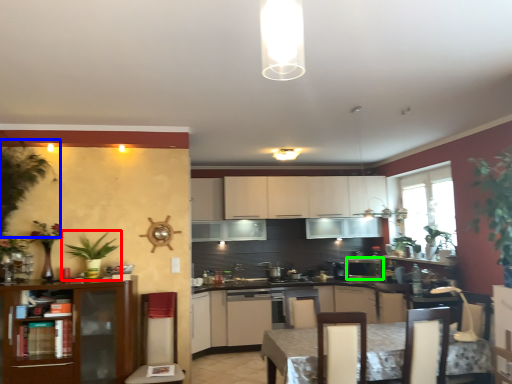
Question: Based on their relative distances, which object is farther from houseplant (highlighted by a red box)? Choose from plant (highlighted by a blue box) and kitchen appliance (highlighted by a green box).

Choices:
 (A) plant
 (B) kitchen appliance

Answer: (B)